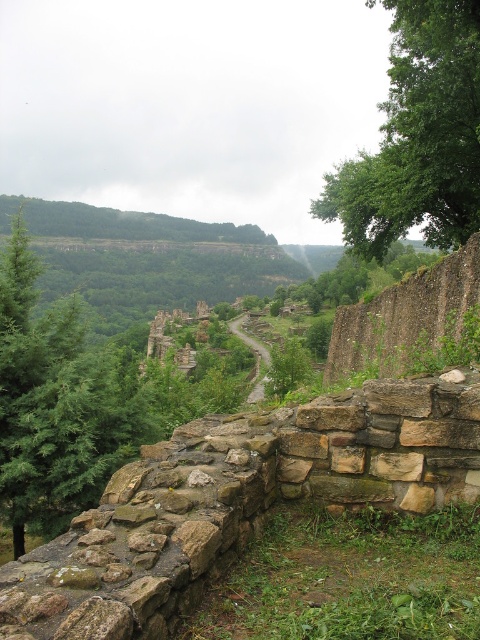
From the picture: Is green leafy tree at upper right above brown stone path at center?

Indeed, green leafy tree at upper right is positioned over brown stone path at center.

Locate an element on the screen. This screenshot has height=640, width=480. green leafy tree at upper right is located at coordinates (418, 136).